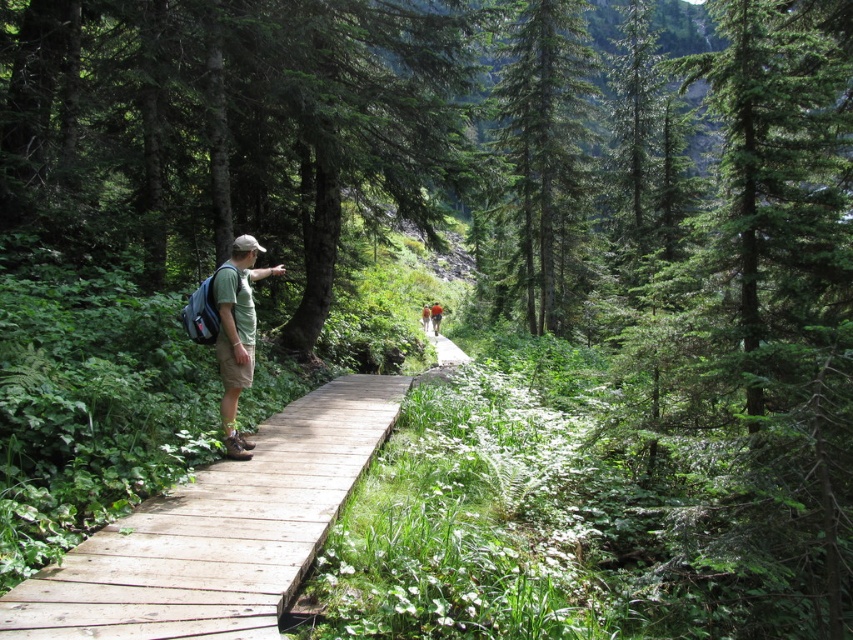
This screenshot has width=853, height=640. Describe the element at coordinates (236, 332) in the screenshot. I see `matte green t-shirt at center` at that location.

Who is positioned more to the left, matte green t-shirt at center or light brown wooden boardwalk at center?

matte green t-shirt at center is more to the left.

Locate an element on the screen. Image resolution: width=853 pixels, height=640 pixels. matte green t-shirt at center is located at coordinates (236, 332).

What are the coordinates of `matte green t-shirt at center` in the screenshot? It's located at (236, 332).

Which of these two, wooden bridge at center or matte green t-shirt at center, stands shorter?

wooden bridge at center

Which is in front, point (154, 612) or point (250, 355)?

Positioned in front is point (154, 612).

Identify the location of wooden bridge at center. This screenshot has height=640, width=853. coord(216,532).

Is point (202, 506) farther from viewer compared to point (560, 88)?

No.

Which is behind, point (109, 540) or point (546, 65)?

The point (546, 65) is more distant.

The image size is (853, 640). Describe the element at coordinates (216, 532) in the screenshot. I see `wooden bridge at center` at that location.

This screenshot has width=853, height=640. What are the coordinates of `wooden bridge at center` in the screenshot? It's located at [216, 532].